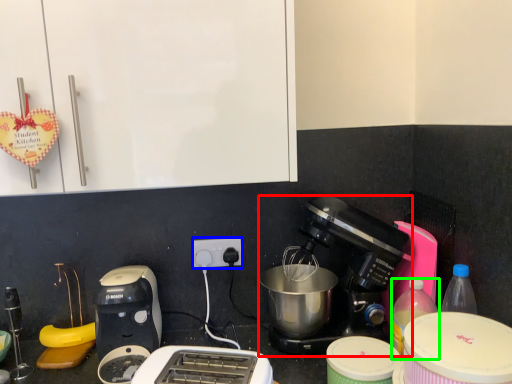
Question: Which object is positioned closest to coffee maker (highlighted by a red box)? Select from power plugs and sockets (highlighted by a blue box) and bottle (highlighted by a green box).

Choices:
 (A) power plugs and sockets
 (B) bottle

Answer: (B)